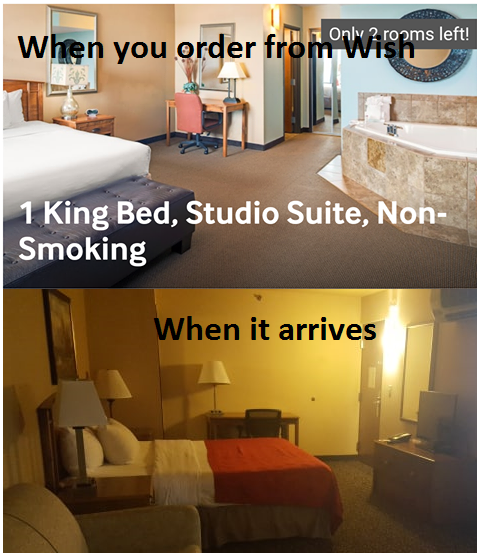
This screenshot has height=553, width=477. I want to click on desk, so click(x=229, y=418).